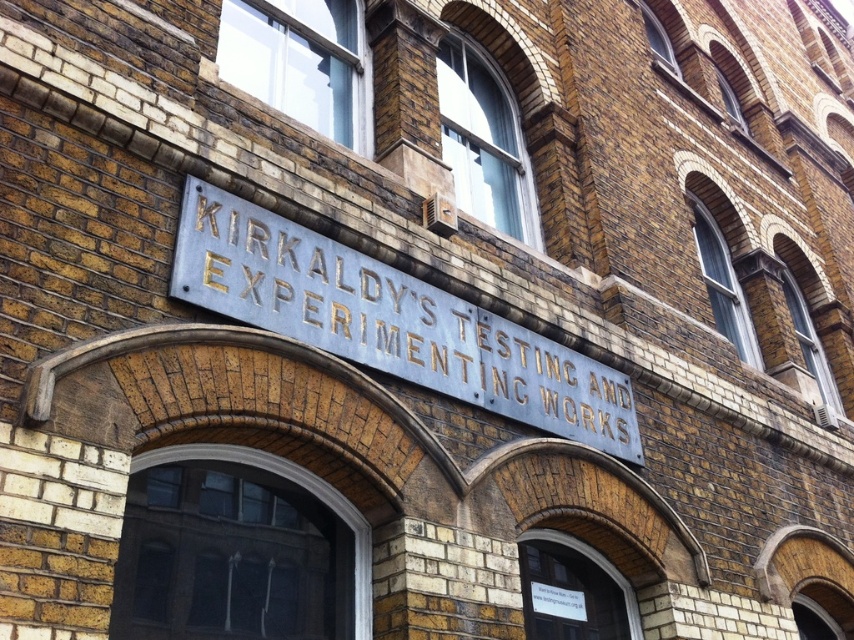
Between point (341, 284) and point (540, 588), which one is positioned behind?

Positioned behind is point (540, 588).

At what (x,y) coordinates should I click in order to perform the action: click on silver metallic sign at center. Please return your answer as a coordinate pair (x, y). The width and height of the screenshot is (854, 640). Looking at the image, I should click on (390, 321).

Is silver metallic sign at center in front of transparent glass door at lower left?

No, silver metallic sign at center is further to the viewer.

Where is `silver metallic sign at center`? This screenshot has width=854, height=640. silver metallic sign at center is located at coordinates (390, 321).

Is silver metallic sign at center above white paper sign at lower center?

Yes, silver metallic sign at center is above white paper sign at lower center.

Can you confirm if silver metallic sign at center is positioned below white paper sign at lower center?

Actually, silver metallic sign at center is above white paper sign at lower center.

The image size is (854, 640). Identify the location of silver metallic sign at center. (390, 321).